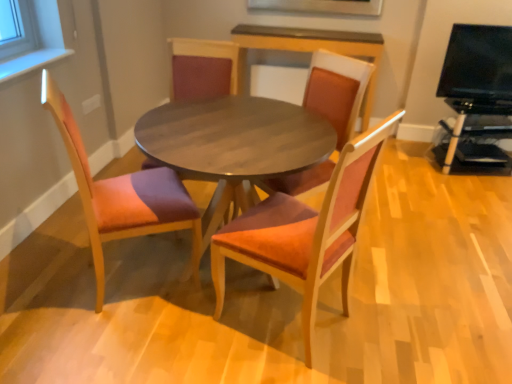
Describe the element at coordinates (233, 145) in the screenshot. I see `wooden round table at center` at that location.

Where is `orange fabric chair at left, the fourth chair viewed from the right`? Image resolution: width=512 pixels, height=384 pixels. orange fabric chair at left, the fourth chair viewed from the right is located at coordinates (122, 195).

What is the approximate height of black glossy tv at upper right, arranged as the second entertainment center when ordered from the bottom?

black glossy tv at upper right, arranged as the second entertainment center when ordered from the bottom, is 22.74 inches in height.

What is the approximate height of wooden table at center?

The height of wooden table at center is 2.42 inches.

This screenshot has width=512, height=384. I want to click on wooden round table at center, so coord(233,145).

In terms of width, does orange fabric chair at left, the first chair from the left, look wider or thinner when compared to suede-like orange chair at center, the first chair viewed from the right?

Considering their sizes, orange fabric chair at left, the first chair from the left, looks slimmer than suede-like orange chair at center, the first chair viewed from the right.

Does point (175, 199) lie in front of point (344, 136)?

Yes, it is in front of point (344, 136).

From a real-world perspective, who is located lower, orange fabric chair at left, the first chair from the left, or suede-like orange chair at center, the first chair viewed from the right?

From a 3D spatial view, orange fabric chair at left, the first chair from the left, is below.

Which object is further away from the camera taking this photo, suede-like orange chair at center, the first chair viewed from the right, or black plastic entertainment center at right, which appears as the second entertainment center when viewed from the top?

Positioned behind is black plastic entertainment center at right, which appears as the second entertainment center when viewed from the top.

Is suede-like orange chair at center, the first chair viewed from the right, bigger than black plastic entertainment center at right, acting as the 1th entertainment center starting from the bottom?

Yes, suede-like orange chair at center, the first chair viewed from the right, is bigger than black plastic entertainment center at right, acting as the 1th entertainment center starting from the bottom.

Does point (356, 87) appear closer or farther from the camera than point (459, 147)?

Point (356, 87) is closer to the camera than point (459, 147).

From the image's perspective, is suede-like orange chair at center, the first chair viewed from the right, above or below black plastic entertainment center at right, which appears as the second entertainment center when viewed from the top?

suede-like orange chair at center, the first chair viewed from the right, is situated lower than black plastic entertainment center at right, which appears as the second entertainment center when viewed from the top, in the image.

From the image's perspective, is black plastic entertainment center at right, acting as the 1th entertainment center starting from the bottom, above or below wooden round table at center?

From the image's perspective, black plastic entertainment center at right, acting as the 1th entertainment center starting from the bottom, appears above wooden round table at center.

In terms of height, does black plastic entertainment center at right, which appears as the second entertainment center when viewed from the top, look taller or shorter compared to wooden round table at center?

Clearly, black plastic entertainment center at right, which appears as the second entertainment center when viewed from the top, is shorter compared to wooden round table at center.

Consider the image. Is black plastic entertainment center at right, which appears as the second entertainment center when viewed from the top, to the left of wooden round table at center from the viewer's perspective?

No, black plastic entertainment center at right, which appears as the second entertainment center when viewed from the top, is not to the left of wooden round table at center.

Starting from the black glossy tv at upper right, which appears as the 1th entertainment center when viewed from the top, which chair is the 3rd one to the left? Please provide its 2D coordinates.

[(203, 69)]

Is matte wood chair at center, which appears as the 3th chair when viewed from the right, surrounding black glossy tv at upper right, arranged as the second entertainment center when ordered from the bottom?

No.

Is matte wood chair at center, which appears as the 3th chair when viewed from the right, far from black glossy tv at upper right, which appears as the 1th entertainment center when viewed from the top?

Yes, matte wood chair at center, which appears as the 3th chair when viewed from the right, and black glossy tv at upper right, which appears as the 1th entertainment center when viewed from the top, are quite far apart.

Which of these two, matte wood chair at center, which appears as the 3th chair when viewed from the right, or black glossy tv at upper right, arranged as the second entertainment center when ordered from the bottom, stands taller?

With more height is matte wood chair at center, which appears as the 3th chair when viewed from the right.

Is matte wood chair at center, the 2th chair in the right-to-left sequence, to the left of wooden table at center from the viewer's perspective?

Yes.

Would you say matte wood chair at center, the 2th chair in the right-to-left sequence, contains wooden table at center?

No, wooden table at center is located outside of matte wood chair at center, the 2th chair in the right-to-left sequence.

In order to click on kitchen & dining room table below the matte wood chair at center, the 2th chair in the right-to-left sequence (from the image's perspective) in this screenshot , I will do `click(268, 172)`.

Relative to wooden table at center, is matte wood chair at center, the 2th chair in the right-to-left sequence, in front or behind?

matte wood chair at center, the 2th chair in the right-to-left sequence, is positioned closer to the viewer than wooden table at center.

Is suede-like orange chair at center, acting as the 4th chair starting from the left, next to matte wood chair at center, which is the 2th chair from left to right, and touching it?

suede-like orange chair at center, acting as the 4th chair starting from the left, is not next to matte wood chair at center, which is the 2th chair from left to right, and they're not touching.

Which of these two, suede-like orange chair at center, acting as the 4th chair starting from the left, or matte wood chair at center, which appears as the 3th chair when viewed from the right, is thinner?

matte wood chair at center, which appears as the 3th chair when viewed from the right.

Looking at this image, from a real-world perspective, which object stands above the other?

From a 3D spatial view, suede-like orange chair at center, acting as the 4th chair starting from the left, is above.

Measure the distance between suede-like orange chair at center, the first chair viewed from the right, and matte wood chair at center, which appears as the 3th chair when viewed from the right.

suede-like orange chair at center, the first chair viewed from the right, is 24.39 inches away from matte wood chair at center, which appears as the 3th chair when viewed from the right.

Considering the sizes of objects black plastic entertainment center at right, which appears as the second entertainment center when viewed from the top, and wooden table at center in the image provided, who is thinner, black plastic entertainment center at right, which appears as the second entertainment center when viewed from the top, or wooden table at center?

With smaller width is black plastic entertainment center at right, which appears as the second entertainment center when viewed from the top.

Is black plastic entertainment center at right, acting as the 1th entertainment center starting from the bottom, situated inside wooden table at center or outside?

black plastic entertainment center at right, acting as the 1th entertainment center starting from the bottom, is not enclosed by wooden table at center.

Is black plastic entertainment center at right, acting as the 1th entertainment center starting from the bottom, positioned with its back to wooden table at center?

black plastic entertainment center at right, acting as the 1th entertainment center starting from the bottom, is not turned away from wooden table at center.

Considering the points (476, 135) and (153, 117), which point is behind, point (476, 135) or point (153, 117)?

Positioned behind is point (476, 135).

Find the location of a particular element. the 1st chair behind the orange fabric chair at left, the fourth chair viewed from the right, starting your count from the anchor is located at coordinates tap(337, 90).

Locate an element on the screen. The height and width of the screenshot is (384, 512). entertainment center below the suede-like orange chair at center, acting as the 4th chair starting from the left (from a real-world perspective) is located at coordinates (476, 134).

Estimate the real-world distances between objects in this image. Which object is closer to matte wood chair at center, which is the 2th chair from left to right, black plastic entertainment center at right, which appears as the second entertainment center when viewed from the top, or suede-like orange chair at center, acting as the 4th chair starting from the left?

Among the two, suede-like orange chair at center, acting as the 4th chair starting from the left, is located nearer to matte wood chair at center, which is the 2th chair from left to right.

Based on the photo, which object lies nearer to the anchor point black glossy tv at upper right, arranged as the second entertainment center when ordered from the bottom, matte wood chair at center, which is the 2th chair from left to right, or wooden round table at center?

matte wood chair at center, which is the 2th chair from left to right, lies closer to black glossy tv at upper right, arranged as the second entertainment center when ordered from the bottom, than the other object.

Based on their spatial positions, is black plastic entertainment center at right, acting as the 1th entertainment center starting from the bottom, or black glossy tv at upper right, arranged as the second entertainment center when ordered from the bottom, closer to wooden round table at center?

black glossy tv at upper right, arranged as the second entertainment center when ordered from the bottom, lies closer to wooden round table at center than the other object.

Based on their spatial positions, is wooden round table at center or matte wood chair at center, which is the 2th chair from left to right, further from suede-like orange chair at center, the first chair viewed from the right?

The object further to suede-like orange chair at center, the first chair viewed from the right, is matte wood chair at center, which is the 2th chair from left to right.

Which object lies nearer to the anchor point wooden round table at center, orange fabric chair at left, the first chair from the left, or suede-like orange chair at center, acting as the 4th chair starting from the left?

suede-like orange chair at center, acting as the 4th chair starting from the left.

Based on their spatial positions, is suede-like orange chair at center, the first chair viewed from the right, or matte wood chair at center, which appears as the 3th chair when viewed from the right, closer to orange fabric chair at left, the first chair from the left?

The object closer to orange fabric chair at left, the first chair from the left, is suede-like orange chair at center, the first chair viewed from the right.

Which object lies further to the anchor point black glossy tv at upper right, which appears as the 1th entertainment center when viewed from the top, suede-like orange chair at center, acting as the 4th chair starting from the left, or matte wood chair at center, which appears as the 3th chair when viewed from the right?

matte wood chair at center, which appears as the 3th chair when viewed from the right, is further to black glossy tv at upper right, which appears as the 1th entertainment center when viewed from the top.

Considering their positions, is matte wood chair at center, the 2th chair in the right-to-left sequence, positioned closer to black plastic entertainment center at right, acting as the 1th entertainment center starting from the bottom, than suede-like orange chair at center, acting as the 4th chair starting from the left?

Based on the image, suede-like orange chair at center, acting as the 4th chair starting from the left, appears to be nearer to black plastic entertainment center at right, acting as the 1th entertainment center starting from the bottom.

Find the location of `coffee table situated between orange fabric chair at left, the fourth chair viewed from the right, and wooden table at center from left to right`. coffee table situated between orange fabric chair at left, the fourth chair viewed from the right, and wooden table at center from left to right is located at coordinates (233, 145).

This screenshot has height=384, width=512. In order to click on entertainment center between matte wood chair at center, which appears as the 3th chair when viewed from the right, and black plastic entertainment center at right, acting as the 1th entertainment center starting from the bottom in this screenshot , I will do `click(477, 91)`.

Locate an element on the screen. entertainment center located between orange fabric chair at left, the first chair from the left, and black plastic entertainment center at right, which appears as the second entertainment center when viewed from the top, in the left-right direction is located at coordinates (477, 91).

In order to click on coffee table located between orange fabric chair at left, the fourth chair viewed from the right, and matte wood chair at center, which is the 2th chair from left to right, in the depth direction in this screenshot , I will do `click(233, 145)`.